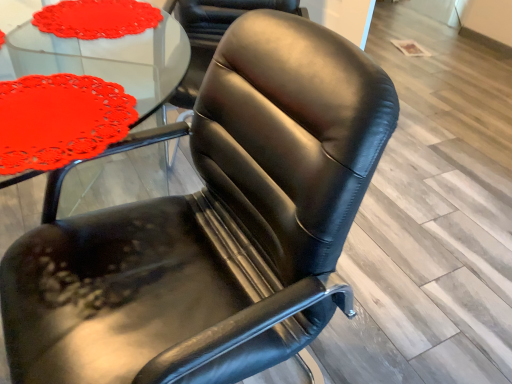
Question: Relative to matte red doily at upper left, is black leather chair at center in front or behind?

Choices:
 (A) behind
 (B) front

Answer: (A)

Question: From their relative heights in the image, would you say black leather chair at center is taller or shorter than matte red doily at upper left?

Choices:
 (A) short
 (B) tall

Answer: (B)

Question: Which object is positioned farthest from the matte glass table at upper left?

Choices:
 (A) black leather chair at center
 (B) matte red doily at upper left

Answer: (B)

Question: Which of these objects is positioned closest to the black leather chair at center?

Choices:
 (A) matte glass table at upper left
 (B) matte red doily at upper left

Answer: (A)